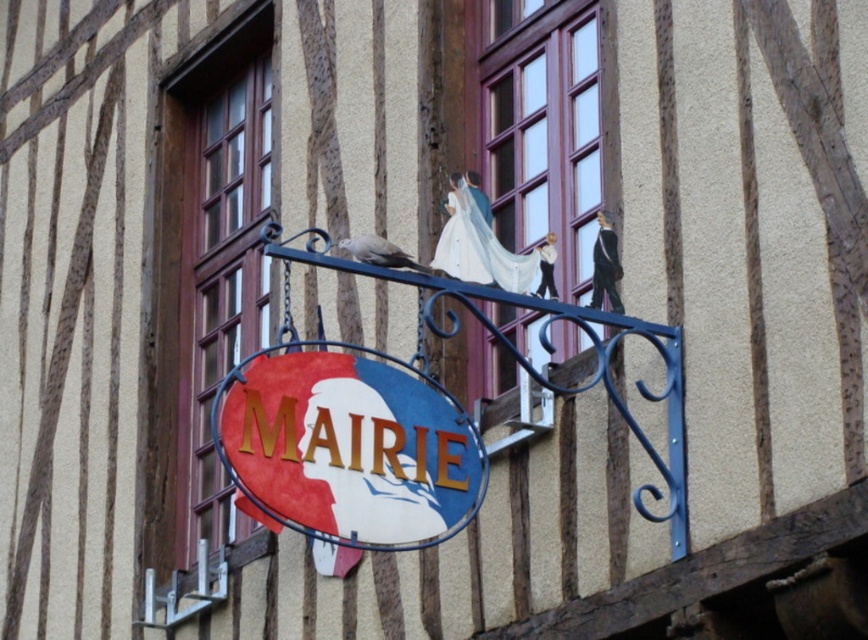
Between wooden window frame at upper center and gray matte pigeon at center, which one appears on the left side from the viewer's perspective?

From the viewer's perspective, gray matte pigeon at center appears more on the left side.

Is wooden window frame at upper center taller than gray matte pigeon at center?

Yes, wooden window frame at upper center is taller than gray matte pigeon at center.

Image resolution: width=868 pixels, height=640 pixels. Describe the element at coordinates (542, 129) in the screenshot. I see `wooden window frame at upper center` at that location.

What are the coordinates of `wooden window frame at upper center` in the screenshot? It's located at (542, 129).

Can you confirm if white satin dress at center is wider than gray matte pigeon at center?

No.

Who is shorter, white satin dress at center or gray matte pigeon at center?

Standing shorter between the two is gray matte pigeon at center.

Where is `white satin dress at center`? This screenshot has height=640, width=868. white satin dress at center is located at coordinates (478, 248).

Which of these two, wooden window at left or gray matte pigeon at center, stands taller?

wooden window at left is taller.

Can you confirm if wooden window at left is positioned above gray matte pigeon at center?

Correct, wooden window at left is located above gray matte pigeon at center.

Does point (271, 10) come closer to viewer compared to point (376, 260)?

No, it is not.

Image resolution: width=868 pixels, height=640 pixels. Identify the location of wooden window at left. (206, 275).